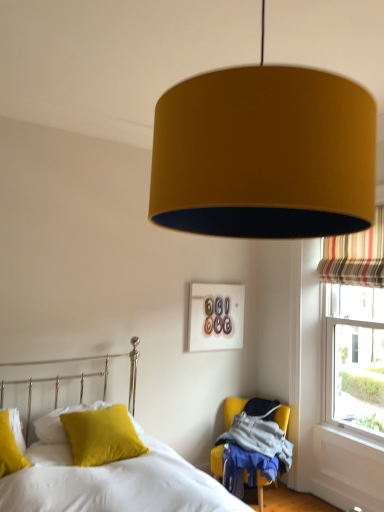
Question: From the image's perspective, is velvet yellow pillow at lower left, the 1th pillow viewed from the back, over matte yellow pillow at lower left, the second pillow when ordered from back to front?

Choices:
 (A) no
 (B) yes

Answer: (A)

Question: Is velvet yellow pillow at lower left, which is the 3th pillow from front to back, completely or partially outside of matte yellow pillow at lower left, the second pillow from the front?

Choices:
 (A) yes
 (B) no

Answer: (B)

Question: Is velvet yellow pillow at lower left, the 1th pillow viewed from the back, facing away from matte yellow pillow at lower left, the second pillow when ordered from back to front?

Choices:
 (A) yes
 (B) no

Answer: (A)

Question: From a real-world perspective, is velvet yellow pillow at lower left, the 1th pillow viewed from the back, below matte yellow pillow at lower left, the second pillow when ordered from back to front?

Choices:
 (A) no
 (B) yes

Answer: (B)

Question: Is velvet yellow pillow at lower left, which is the 3th pillow from front to back, positioned behind matte yellow pillow at lower left, the second pillow from the front?

Choices:
 (A) yes
 (B) no

Answer: (A)

Question: Is velvet yellow pillow at lower left, which is the first pillow from front to back, taller or shorter than mustard fabric lampshade at upper center?

Choices:
 (A) tall
 (B) short

Answer: (B)

Question: From the image's perspective, is velvet yellow pillow at lower left, which ranks as the third pillow in back-to-front order, positioned above or below mustard fabric lampshade at upper center?

Choices:
 (A) below
 (B) above

Answer: (A)

Question: Based on their positions, is velvet yellow pillow at lower left, which is the first pillow from front to back, located to the left or right of mustard fabric lampshade at upper center?

Choices:
 (A) right
 (B) left

Answer: (B)

Question: Is velvet yellow pillow at lower left, which is the first pillow from front to back, spatially inside mustard fabric lampshade at upper center, or outside of it?

Choices:
 (A) outside
 (B) inside

Answer: (A)

Question: Considering the positions of point (49, 426) and point (182, 161), is point (49, 426) closer or farther from the camera than point (182, 161)?

Choices:
 (A) closer
 (B) farther

Answer: (B)

Question: Do you think velvet yellow pillow at lower left, which is the 3th pillow from front to back, is within mustard fabric lampshade at upper center, or outside of it?

Choices:
 (A) outside
 (B) inside

Answer: (A)

Question: From the image's perspective, is velvet yellow pillow at lower left, the 1th pillow viewed from the back, above or below mustard fabric lampshade at upper center?

Choices:
 (A) above
 (B) below

Answer: (B)

Question: From their relative heights in the image, would you say velvet yellow pillow at lower left, the 1th pillow viewed from the back, is taller or shorter than mustard fabric lampshade at upper center?

Choices:
 (A) short
 (B) tall

Answer: (A)

Question: Relative to soft yellow pillow at lower left, is mustard fabric chair at lower right in front or behind?

Choices:
 (A) front
 (B) behind

Answer: (B)

Question: Considering the relative positions of mustard fabric chair at lower right and soft yellow pillow at lower left in the image provided, is mustard fabric chair at lower right to the left or to the right of soft yellow pillow at lower left?

Choices:
 (A) right
 (B) left

Answer: (A)